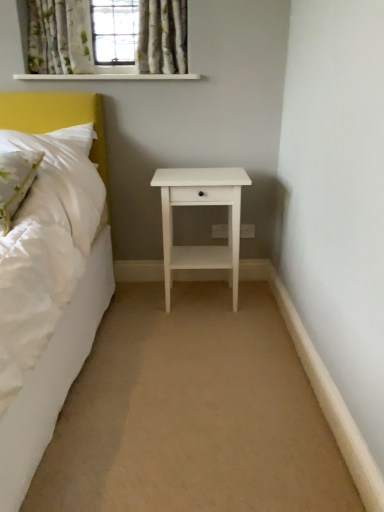
Question: Is green floral fabric pillow at left wider than floral fabric curtain at upper center, the 1th curtain positioned from the right?

Choices:
 (A) no
 (B) yes

Answer: (B)

Question: From the image's perspective, is green floral fabric pillow at left on floral fabric curtain at upper center, the 1th curtain positioned from the right?

Choices:
 (A) no
 (B) yes

Answer: (A)

Question: Considering the relative positions of green floral fabric pillow at left and floral fabric curtain at upper center, which is counted as the second curtain, starting from the left, in the image provided, is green floral fabric pillow at left to the right of floral fabric curtain at upper center, which is counted as the second curtain, starting from the left, from the viewer's perspective?

Choices:
 (A) yes
 (B) no

Answer: (B)

Question: Can you confirm if green floral fabric pillow at left is taller than floral fabric curtain at upper center, the 1th curtain positioned from the right?

Choices:
 (A) no
 (B) yes

Answer: (A)

Question: Is floral fabric curtain at upper center, the 1th curtain positioned from the right, completely or partially inside green floral fabric pillow at left?

Choices:
 (A) yes
 (B) no

Answer: (B)

Question: In the image, is green floral fabric pillow at left on the left side or the right side of patterned fabric curtain at upper center?

Choices:
 (A) left
 (B) right

Answer: (A)

Question: Does point (3, 233) appear closer or farther from the camera than point (92, 58)?

Choices:
 (A) farther
 (B) closer

Answer: (B)

Question: Is green floral fabric pillow at left wider or thinner than patterned fabric curtain at upper center?

Choices:
 (A) wide
 (B) thin

Answer: (A)

Question: Considering the positions of green floral fabric pillow at left and patterned fabric curtain at upper center in the image, is green floral fabric pillow at left bigger or smaller than patterned fabric curtain at upper center?

Choices:
 (A) big
 (B) small

Answer: (B)

Question: Looking at their shapes, would you say floral fabric curtain at upper center, the 1th curtain positioned from the right, is wider or thinner than green floral fabric curtain at upper left, which is counted as the 1th curtain, starting from the left?

Choices:
 (A) thin
 (B) wide

Answer: (B)

Question: Visually, is floral fabric curtain at upper center, the 1th curtain positioned from the right, positioned to the left or to the right of green floral fabric curtain at upper left, the second curtain positioned from the right?

Choices:
 (A) left
 (B) right

Answer: (B)

Question: Considering the positions of floral fabric curtain at upper center, the 1th curtain positioned from the right, and green floral fabric curtain at upper left, which is counted as the 1th curtain, starting from the left, in the image, is floral fabric curtain at upper center, the 1th curtain positioned from the right, taller or shorter than green floral fabric curtain at upper left, which is counted as the 1th curtain, starting from the left,?

Choices:
 (A) short
 (B) tall

Answer: (B)

Question: From a real-world perspective, is floral fabric curtain at upper center, the 1th curtain positioned from the right, above or below green floral fabric curtain at upper left, which is counted as the 1th curtain, starting from the left?

Choices:
 (A) above
 (B) below

Answer: (B)

Question: Is patterned fabric curtain at upper center in front of or behind green floral fabric curtain at upper left, the second curtain positioned from the right, in the image?

Choices:
 (A) front
 (B) behind

Answer: (A)

Question: Looking at the image, does patterned fabric curtain at upper center seem bigger or smaller compared to green floral fabric curtain at upper left, which is counted as the 1th curtain, starting from the left?

Choices:
 (A) small
 (B) big

Answer: (B)